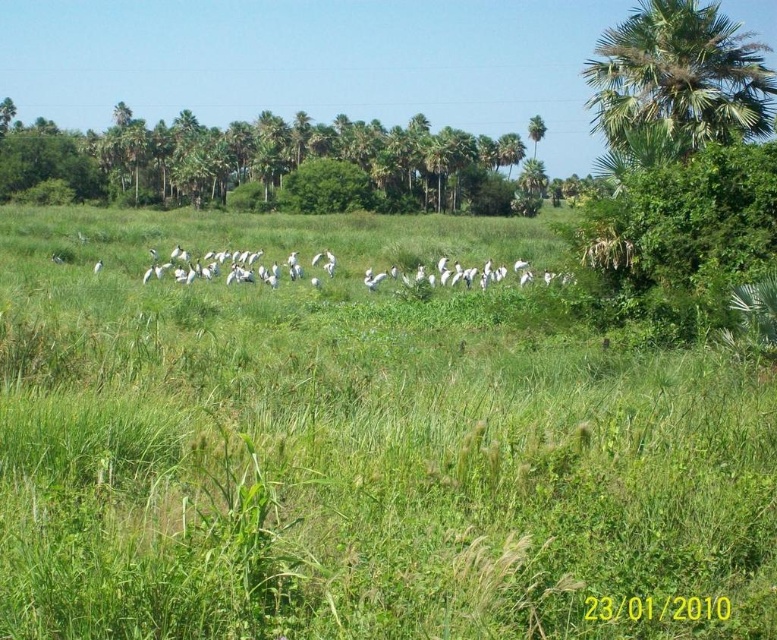
Question: Is green grassy at center above green leafy palm tree at upper right?

Choices:
 (A) yes
 (B) no

Answer: (B)

Question: Does green leafy trees at upper left appear under green leafy palm tree at upper right?

Choices:
 (A) yes
 (B) no

Answer: (A)

Question: Which of the following is the farthest from the observer?

Choices:
 (A) white matte bird at center
 (B) green leafy palm tree at upper right
 (C) green leafy trees at upper left
 (D) green grassy at center

Answer: (C)

Question: Which object appears closest to the camera in this image?

Choices:
 (A) green grassy at center
 (B) white matte bird at center
 (C) green leafy trees at upper left

Answer: (A)

Question: Based on their relative distances, which object is nearer to the green leafy palm tree at upper right?

Choices:
 (A) green leafy trees at upper left
 (B) green grassy at center

Answer: (B)

Question: In this image, where is green leafy trees at upper left located relative to green leafy palm tree at upper right?

Choices:
 (A) above
 (B) below

Answer: (B)